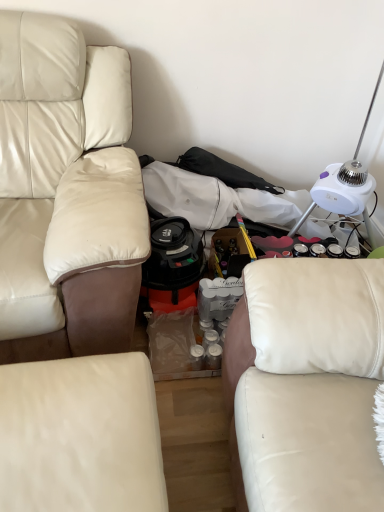
Question: Is beige leather couch at left, acting as the first studio couch starting from the left, wider than white leather studio couch at right, the first studio couch when ordered from right to left?

Choices:
 (A) no
 (B) yes

Answer: (B)

Question: Is beige leather couch at left, which appears as the 3th studio couch when viewed from the right, not inside white leather studio couch at right, placed as the third studio couch when sorted from left to right?

Choices:
 (A) no
 (B) yes

Answer: (B)

Question: Does beige leather couch at left, which appears as the 3th studio couch when viewed from the right, have a lesser width compared to white leather studio couch at right, placed as the third studio couch when sorted from left to right?

Choices:
 (A) yes
 (B) no

Answer: (B)

Question: From a real-world perspective, is beige leather couch at left, which appears as the 3th studio couch when viewed from the right, physically below white leather studio couch at right, the first studio couch when ordered from right to left?

Choices:
 (A) no
 (B) yes

Answer: (B)

Question: From the image's perspective, is beige leather couch at left, acting as the first studio couch starting from the left, under white leather studio couch at right, the first studio couch when ordered from right to left?

Choices:
 (A) no
 (B) yes

Answer: (A)

Question: From the image's perspective, relative to white plastic table lamp at upper right, is white leather studio couch at lower center, which appears as the second studio couch when viewed from the right, above or below?

Choices:
 (A) below
 (B) above

Answer: (A)

Question: Considering the positions of white leather studio couch at lower center, arranged as the 2th studio couch when viewed from the left, and white plastic table lamp at upper right in the image, is white leather studio couch at lower center, arranged as the 2th studio couch when viewed from the left, taller or shorter than white plastic table lamp at upper right?

Choices:
 (A) short
 (B) tall

Answer: (A)

Question: In the image, is white leather studio couch at lower center, which appears as the second studio couch when viewed from the right, on the left side or the right side of white plastic table lamp at upper right?

Choices:
 (A) left
 (B) right

Answer: (A)

Question: Do you think white leather studio couch at lower center, which appears as the second studio couch when viewed from the right, is within white plastic table lamp at upper right, or outside of it?

Choices:
 (A) outside
 (B) inside

Answer: (A)

Question: From their relative heights in the image, would you say beige leather couch at left, which appears as the 3th studio couch when viewed from the right, is taller or shorter than white plastic table lamp at upper right?

Choices:
 (A) short
 (B) tall

Answer: (B)

Question: Is point (148, 231) positioned closer to the camera than point (364, 195)?

Choices:
 (A) closer
 (B) farther

Answer: (A)

Question: Looking at the image, does beige leather couch at left, acting as the first studio couch starting from the left, seem bigger or smaller compared to white plastic table lamp at upper right?

Choices:
 (A) small
 (B) big

Answer: (B)

Question: In the image, is beige leather couch at left, which appears as the 3th studio couch when viewed from the right, positioned in front of or behind white plastic table lamp at upper right?

Choices:
 (A) behind
 (B) front

Answer: (B)

Question: Is white plastic table lamp at upper right bigger or smaller than beige leather couch at left, which appears as the 3th studio couch when viewed from the right?

Choices:
 (A) big
 (B) small

Answer: (B)

Question: In the image, is white plastic table lamp at upper right on the left side or the right side of beige leather couch at left, which appears as the 3th studio couch when viewed from the right?

Choices:
 (A) right
 (B) left

Answer: (A)